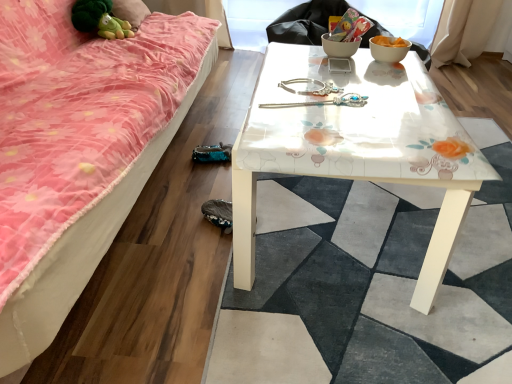
Question: Would you say white glossy bowl at upper right contains green plush toy at upper left?

Choices:
 (A) no
 (B) yes

Answer: (A)

Question: Considering the relative sizes of white glossy bowl at upper right and green plush toy at upper left in the image provided, is white glossy bowl at upper right thinner than green plush toy at upper left?

Choices:
 (A) yes
 (B) no

Answer: (A)

Question: Can you confirm if white glossy bowl at upper right is wider than green plush toy at upper left?

Choices:
 (A) no
 (B) yes

Answer: (A)

Question: Are white glossy bowl at upper right and green plush toy at upper left far apart?

Choices:
 (A) no
 (B) yes

Answer: (B)

Question: From a real-world perspective, is white glossy bowl at upper right beneath green plush toy at upper left?

Choices:
 (A) yes
 (B) no

Answer: (B)

Question: Could you tell me if white glossy bowl at upper right is facing green plush toy at upper left?

Choices:
 (A) yes
 (B) no

Answer: (B)

Question: Is pink fabric studio couch at lower left oriented towards white glossy table at center?

Choices:
 (A) no
 (B) yes

Answer: (B)

Question: Is pink fabric studio couch at lower left looking in the opposite direction of white glossy table at center?

Choices:
 (A) yes
 (B) no

Answer: (B)

Question: From the image's perspective, does pink fabric studio couch at lower left appear higher than white glossy table at center?

Choices:
 (A) no
 (B) yes

Answer: (B)

Question: Is pink fabric studio couch at lower left completely or partially outside of white glossy table at center?

Choices:
 (A) yes
 (B) no

Answer: (A)

Question: Is white glossy table at center surrounded by pink fabric studio couch at lower left?

Choices:
 (A) yes
 (B) no

Answer: (B)

Question: Does pink fabric studio couch at lower left have a lesser width compared to white glossy table at center?

Choices:
 (A) yes
 (B) no

Answer: (A)

Question: From a real-world perspective, is white glossy bowl at upper right physically below white glossy table at center?

Choices:
 (A) no
 (B) yes

Answer: (A)